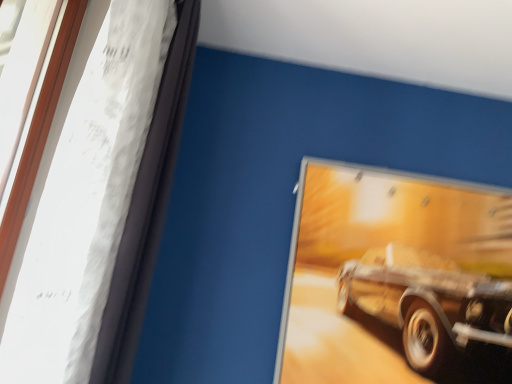
This screenshot has width=512, height=384. What do you see at coordinates (391, 272) in the screenshot?
I see `metallic gold car at upper right` at bounding box center [391, 272].

Measure the distance between metallic gold car at upper right and camera.

metallic gold car at upper right and camera are 5.39 feet apart.

Where is `metallic gold car at upper right`? This screenshot has width=512, height=384. metallic gold car at upper right is located at coordinates (391, 272).

Consider the image. What is the approximate height of metallic gold car at upper right?

The height of metallic gold car at upper right is 37.90 inches.

What do you see at coordinates (104, 202) in the screenshot? The width and height of the screenshot is (512, 384). I see `wooden frame at left` at bounding box center [104, 202].

The height and width of the screenshot is (384, 512). Find the location of `wooden frame at left`. wooden frame at left is located at coordinates (104, 202).

Locate an element on the screen. Image resolution: width=512 pixels, height=384 pixels. metallic gold car at upper right is located at coordinates (391, 272).

Can you confirm if metallic gold car at upper right is positioned to the right of wooden frame at left?

Yes.

Is metallic gold car at upper right further to the viewer compared to wooden frame at left?

Yes.

Is point (500, 266) positioned after point (72, 141)?

Yes, it is behind point (72, 141).

From the image's perspective, is metallic gold car at upper right beneath wooden frame at left?

Correct, metallic gold car at upper right appears lower than wooden frame at left in the image.

From a real-world perspective, between metallic gold car at upper right and wooden frame at left, who is vertically higher?

wooden frame at left is physically above.

Between metallic gold car at upper right and wooden frame at left, which one has smaller width?

Thinner between the two is metallic gold car at upper right.

Which of these two, metallic gold car at upper right or wooden frame at left, stands taller?

Standing taller between the two is wooden frame at left.

Does metallic gold car at upper right have a larger size compared to wooden frame at left?

No.

Does metallic gold car at upper right contain wooden frame at left?

No, wooden frame at left is not surrounded by metallic gold car at upper right.

Is metallic gold car at upper right next to wooden frame at left?

There is a gap between metallic gold car at upper right and wooden frame at left.

Is wooden frame at left at the back of metallic gold car at upper right?

No.

How different are the orientations of metallic gold car at upper right and wooden frame at left in degrees?

91.2 degrees separate the facing orientations of metallic gold car at upper right and wooden frame at left.

How distant is metallic gold car at upper right from wooden frame at left?

A distance of 37.25 inches exists between metallic gold car at upper right and wooden frame at left.

Find the location of a particular element. window frame above the metallic gold car at upper right (from the image's perspective) is located at coordinates (104, 202).

Is wooden frame at left at the left side of metallic gold car at upper right?

Correct, you'll find wooden frame at left to the left of metallic gold car at upper right.

Considering the relative positions of wooden frame at left and metallic gold car at upper right in the image provided, is wooden frame at left in front of metallic gold car at upper right?

That is True.

Which is in front, point (98, 38) or point (343, 223)?

The point (98, 38) is more forward.

From the image's perspective, who appears lower, wooden frame at left or metallic gold car at upper right?

metallic gold car at upper right, from the image's perspective.

From a real-world perspective, is wooden frame at left located beneath metallic gold car at upper right?

No, from a real-world perspective, wooden frame at left is not under metallic gold car at upper right.

Is wooden frame at left thinner than metallic gold car at upper right?

In fact, wooden frame at left might be wider than metallic gold car at upper right.

Can you confirm if wooden frame at left is taller than metallic gold car at upper right?

Indeed, wooden frame at left has a greater height compared to metallic gold car at upper right.

Which of these two, wooden frame at left or metallic gold car at upper right, is smaller?

metallic gold car at upper right.

Looking at this image, is wooden frame at left inside or outside of metallic gold car at upper right?

wooden frame at left exists outside the volume of metallic gold car at upper right.

Is wooden frame at left far away from metallic gold car at upper right?

Actually, wooden frame at left and metallic gold car at upper right are a little close together.

Is wooden frame at left positioned with its back to metallic gold car at upper right?

No, wooden frame at left's orientation is not away from metallic gold car at upper right.

What's the angular difference between wooden frame at left and metallic gold car at upper right's facing directions?

They differ by 91.2 degrees in their facing directions.

Find the location of a particular element. window frame on the left of metallic gold car at upper right is located at coordinates (104, 202).

Image resolution: width=512 pixels, height=384 pixels. What are the coordinates of `car that appears behind the wooden frame at left` in the screenshot? It's located at (391, 272).

This screenshot has height=384, width=512. Find the location of `window frame that appears on the left of metallic gold car at upper right`. window frame that appears on the left of metallic gold car at upper right is located at coordinates (104, 202).